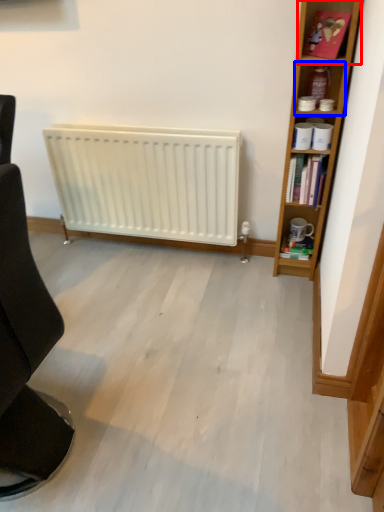
Question: Which point is further to the camera, cabinet (highlighted by a red box) or shelf (highlighted by a blue box)?

Choices:
 (A) cabinet
 (B) shelf

Answer: (B)